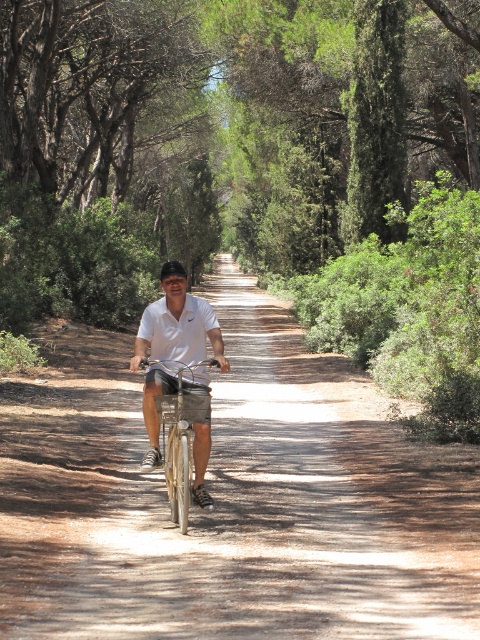
You are a cyclist approaching the dirt path at center and the white matte shirt at center. Which object is closer to you as you ride forward?

The dirt path at center is in front of the white matte shirt at center, so the dirt path at center is closer to you as you ride forward.